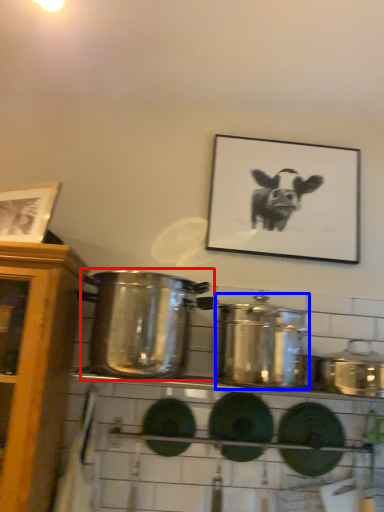
Question: Which point is further to the camera, crock pot (highlighted by a red box) or crock pot (highlighted by a blue box)?

Choices:
 (A) crock pot
 (B) crock pot

Answer: (A)